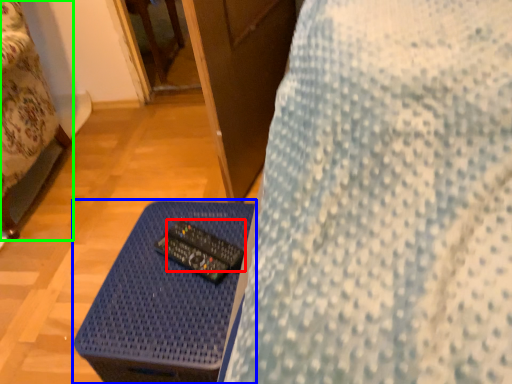
Question: Which object is the closest to the control (highlighted by a red box)? Choose among these: table (highlighted by a blue box) or furniture (highlighted by a green box).

Choices:
 (A) table
 (B) furniture

Answer: (A)